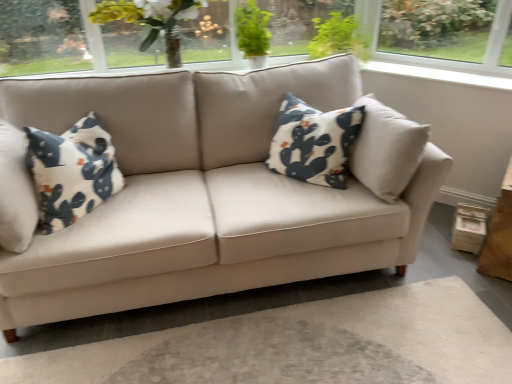
Question: Is translucent glass vase at upper center not close to green leafy plant at upper center?

Choices:
 (A) yes
 (B) no

Answer: (B)

Question: From the image's perspective, is translucent glass vase at upper center located beneath green leafy plant at upper center?

Choices:
 (A) no
 (B) yes

Answer: (B)

Question: From a real-world perspective, is translucent glass vase at upper center physically below green leafy plant at upper center?

Choices:
 (A) no
 (B) yes

Answer: (A)

Question: Would you say translucent glass vase at upper center is outside green leafy plant at upper center?

Choices:
 (A) yes
 (B) no

Answer: (A)

Question: Is translucent glass vase at upper center positioned in front of green leafy plant at upper center?

Choices:
 (A) yes
 (B) no

Answer: (A)

Question: Does translucent glass vase at upper center have a lesser width compared to green leafy plant at upper center?

Choices:
 (A) no
 (B) yes

Answer: (A)

Question: Can you confirm if translucent glass vase at upper center is bigger than wooden table at lower right?

Choices:
 (A) no
 (B) yes

Answer: (B)

Question: Considering the relative sizes of translucent glass vase at upper center and wooden table at lower right in the image provided, is translucent glass vase at upper center wider than wooden table at lower right?

Choices:
 (A) yes
 (B) no

Answer: (B)

Question: Considering the relative positions of translucent glass vase at upper center and wooden table at lower right in the image provided, is translucent glass vase at upper center to the left of wooden table at lower right from the viewer's perspective?

Choices:
 (A) no
 (B) yes

Answer: (B)

Question: From a real-world perspective, is translucent glass vase at upper center below wooden table at lower right?

Choices:
 (A) yes
 (B) no

Answer: (B)

Question: From the image's perspective, does translucent glass vase at upper center appear lower than wooden table at lower right?

Choices:
 (A) yes
 (B) no

Answer: (B)

Question: Considering the relative sizes of translucent glass vase at upper center and wooden table at lower right in the image provided, is translucent glass vase at upper center thinner than wooden table at lower right?

Choices:
 (A) yes
 (B) no

Answer: (A)

Question: Does green leafy plant at upper center have a lesser height compared to wooden table at lower right?

Choices:
 (A) yes
 (B) no

Answer: (A)